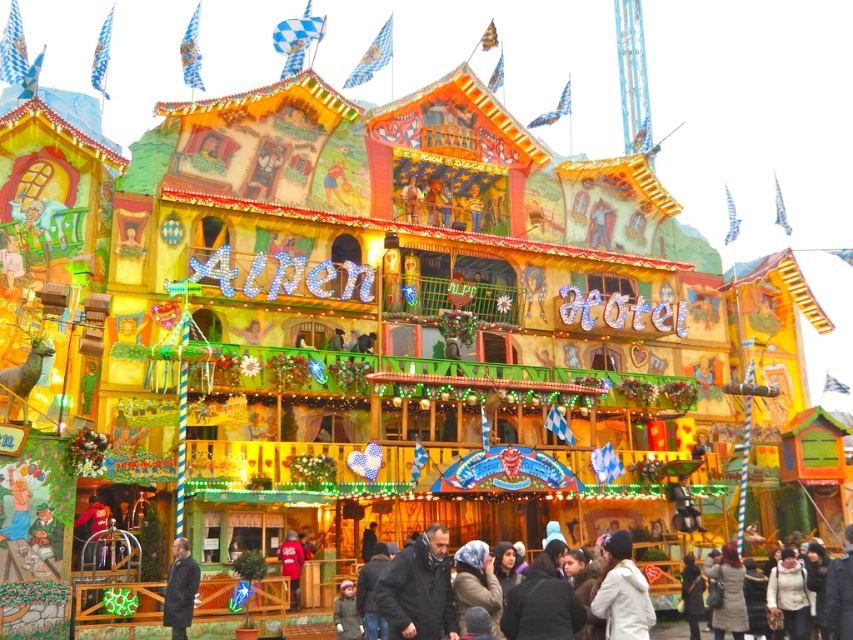
Question: Is black matte jacket at center below dark gray coat at lower left?

Choices:
 (A) no
 (B) yes

Answer: (B)

Question: Is black matte jacket at center below dark gray coat at lower left?

Choices:
 (A) yes
 (B) no

Answer: (A)

Question: Is black matte jacket at center to the right of dark gray coat at lower left from the viewer's perspective?

Choices:
 (A) yes
 (B) no

Answer: (A)